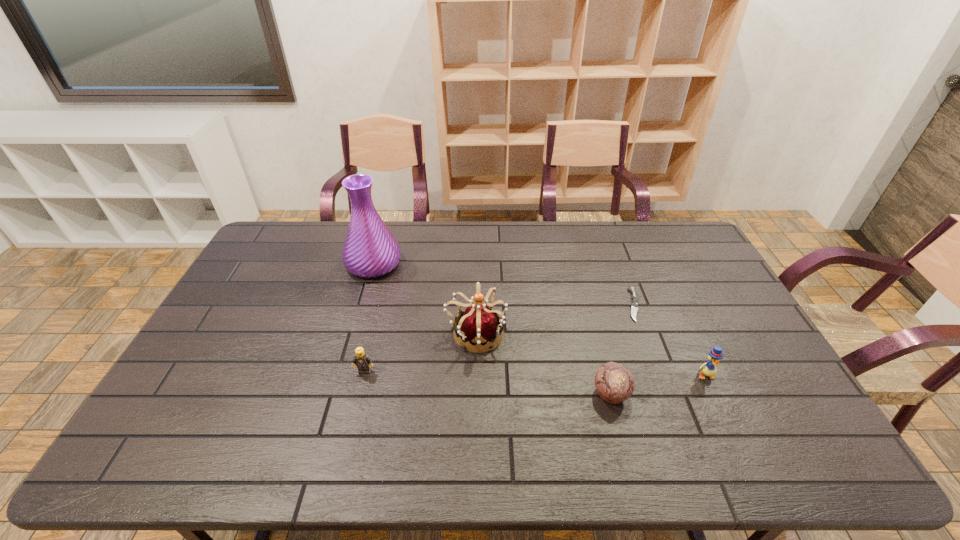
This screenshot has height=540, width=960. What are the coordinates of `free point at the far right corner` in the screenshot? It's located at (677, 250).

This screenshot has width=960, height=540. What are the coordinates of `free spot between the vase and the duckling` in the screenshot? It's located at (540, 320).

The height and width of the screenshot is (540, 960). I want to click on unoccupied area between the muffin and the pocketknife, so click(622, 349).

Locate an element on the screen. Image resolution: width=960 pixels, height=540 pixels. empty space that is in between the third object from right to left and the rightmost object is located at coordinates (658, 384).

Identify the location of empty space between the fifth shortest object and the third object from right to left. (543, 363).

Image resolution: width=960 pixels, height=540 pixels. Find the location of `free space between the Lego and the tiara`. free space between the Lego and the tiara is located at coordinates (420, 352).

Image resolution: width=960 pixels, height=540 pixels. In order to click on empty space that is in between the Lego and the fourth object from left to right in this screenshot , I will do `click(488, 382)`.

Find the location of `free space that is in between the Lego and the tiara`. free space that is in between the Lego and the tiara is located at coordinates (420, 352).

The height and width of the screenshot is (540, 960). I want to click on vacant point located between the third object from right to left and the shortest object, so click(x=622, y=349).

The width and height of the screenshot is (960, 540). In order to click on vacant space in between the muffin and the second object from right to left in this screenshot , I will do `click(622, 349)`.